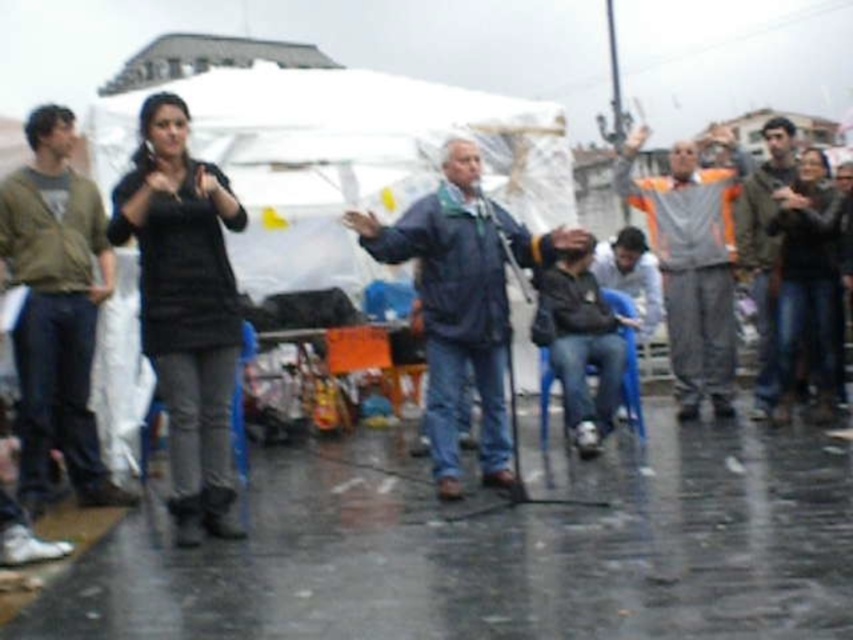
You are a photographer trying to capture a group photo of the black matte shirt at upper left and the orange reflective vest at center. Which person should you focus on first to ensure they are in the frame?

The black matte shirt at upper left is smaller than the orange reflective vest at center, so you should focus on the orange reflective vest at center first to ensure it is fully in the frame.

You are a photographer standing at the center of the scene. You want to take a photo that includes both the black matte shirt at upper left and the black matte jacket at upper right. Given that your camera has a maximum field of view of 4 meters, will you be able to capture both subjects in a single frame without moving?

The black matte shirt at upper left and black matte jacket at upper right are 4.71 meters apart from each other. Since the distance between them exceeds the camera field of view of 4 meters, you cannot capture both subjects in a single frame without moving.